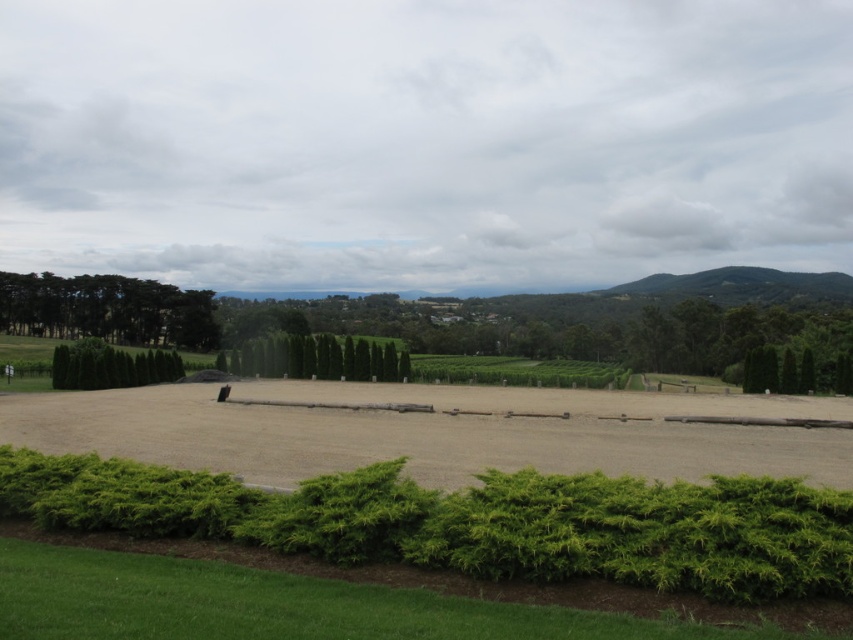
Question: Among these objects, which one is nearest to the camera?

Choices:
 (A) green leafy hedge at lower center
 (B) green leafy trees at upper left
 (C) green leafy hedge at left
 (D) green textured hedge at center

Answer: (A)

Question: Can you confirm if green leafy hedge at lower center is positioned to the left of green leafy hedge at left?

Choices:
 (A) yes
 (B) no

Answer: (B)

Question: Does green leafy hedge at lower center have a larger size compared to green textured hedge at center?

Choices:
 (A) yes
 (B) no

Answer: (B)

Question: Which object is positioned closest to the green leafy trees at upper left?

Choices:
 (A) green textured hedge at center
 (B) green leafy hedge at lower center
 (C) green leafy hedge at left

Answer: (A)

Question: Which point is closer to the camera?

Choices:
 (A) (132, 333)
 (B) (383, 353)
 (C) (618, 547)

Answer: (C)

Question: Is green leafy trees at upper left further to camera compared to green leafy hedge at left?

Choices:
 (A) no
 (B) yes

Answer: (B)